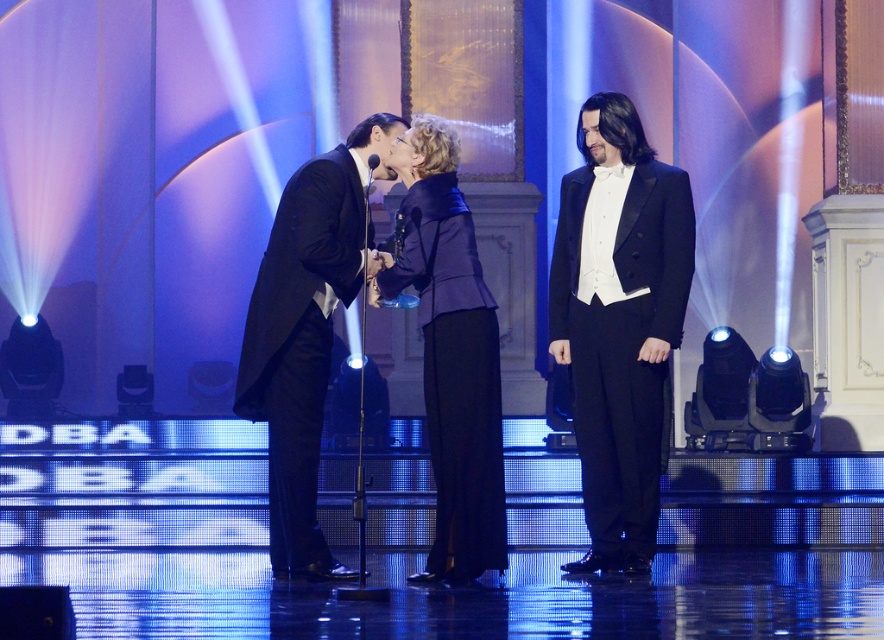
You are a photographer at the event and want to capture a photo where both the black satin tuxedo at right and the black satin tuxedo at left are clearly visible. Which tuxedo should you focus on first to ensure proper framing?

The black satin tuxedo at right is taller than the black satin tuxedo at left, so focusing on it first will help frame both subjects appropriately.

You are a photographer at the event and need to capture a photo where both black satin tuxedo at right and black satin tuxedo at left are clearly visible. Based on their positions, which one should you focus on first to ensure the leftmost subject is in frame?

You should focus on the black satin tuxedo at left first because it is positioned to the left of the black satin tuxedo at right, making it the leftmost subject.

You are a photographer at the event and want to capture a closeup of both the black satin tuxedo at right and the velvet blue blazer at center. Given that your camera frame can only accommodate the width of one of the outfits, which one should you focus on to ensure it fits within the frame?

The black satin tuxedo at right has a greater width than the velvet blue blazer at center, so focusing on the black satin tuxedo at right will ensure it fits within the camera frame.